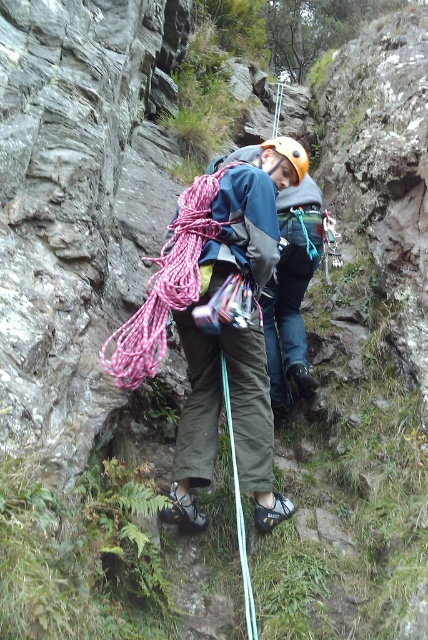
Which is in front, point (205, 385) or point (178, 216)?

Positioned in front is point (205, 385).

Who is positioned more to the left, matte blue jacket at center or pink nylon rope at center?

pink nylon rope at center is more to the left.

Between point (255, 266) and point (202, 212), which one is positioned behind?

Point (202, 212)

You are a GUI agent. You are given a task and a screenshot of the screen. Output one action in this format:
    pyautogui.click(x=<x>, y=<y>)
    Task: Click on the matte blue jacket at center
    Image resolution: width=428 pixels, height=640 pixels.
    Given the screenshot: What is the action you would take?
    pyautogui.click(x=217, y=419)

Between matte blue jacket at center and yellow matte helmet at center, which one is positioned lower?

matte blue jacket at center is lower down.

Can you confirm if matte blue jacket at center is thinner than yellow matte helmet at center?

Yes, matte blue jacket at center is thinner than yellow matte helmet at center.

Between point (205, 452) and point (276, 144), which one is positioned behind?

Positioned behind is point (276, 144).

The image size is (428, 640). In order to click on matte blue jacket at center in this screenshot , I will do `click(217, 419)`.

Between point (118, 353) and point (294, 163), which one is positioned behind?

The point (294, 163) is behind.

Who is higher up, pink nylon rope at center or yellow matte helmet at center?

yellow matte helmet at center is above.

Is point (187, 202) farther from viewer compared to point (303, 163)?

No, (187, 202) is in front of (303, 163).

Identify the location of pink nylon rope at center. The width and height of the screenshot is (428, 640). (166, 285).